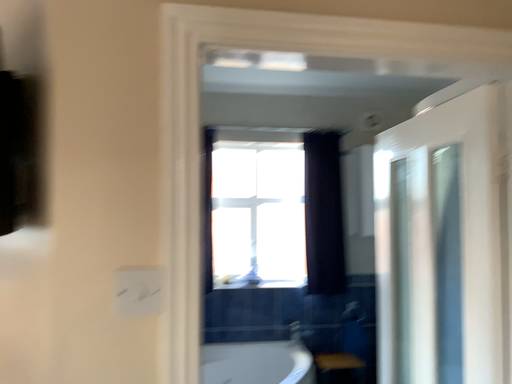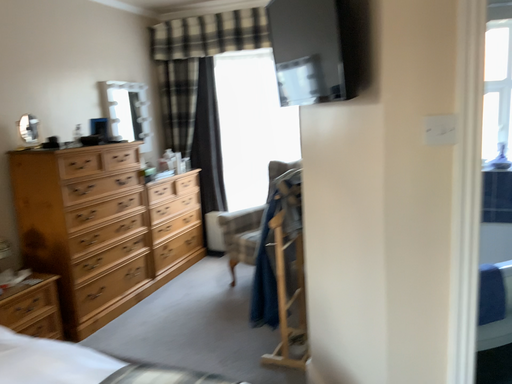
Question: How did the camera likely rotate when shooting the video?

Choices:
 (A) rotated downward
 (B) rotated upward

Answer: (A)